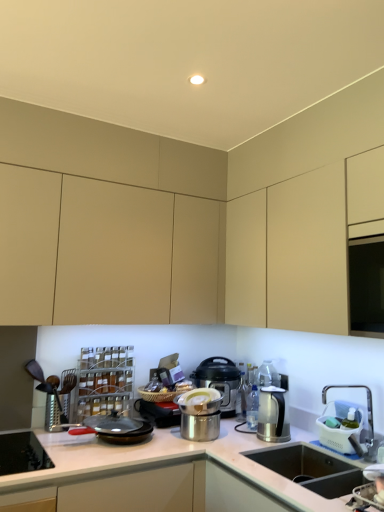
The width and height of the screenshot is (384, 512). Find the location of `free point above brushed metal stove at lower left (from a real-world perspective)`. free point above brushed metal stove at lower left (from a real-world perspective) is located at coordinates [x=13, y=439].